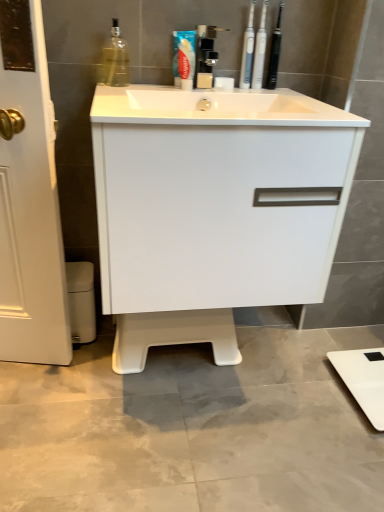
Question: Is white plastic toothbrushes at upper right, placed as the third toiletry when sorted from right to left, touching blue glossy toothpaste at upper center?

Choices:
 (A) no
 (B) yes

Answer: (A)

Question: Is white plastic toothbrushes at upper right, placed as the third toiletry when sorted from right to left, positioned behind blue glossy toothpaste at upper center?

Choices:
 (A) yes
 (B) no

Answer: (A)

Question: Is white plastic toothbrushes at upper right, which is the first toiletry from left to right, to the left of blue glossy toothpaste at upper center from the viewer's perspective?

Choices:
 (A) yes
 (B) no

Answer: (B)

Question: Considering the relative sizes of white plastic toothbrushes at upper right, placed as the third toiletry when sorted from right to left, and blue glossy toothpaste at upper center in the image provided, is white plastic toothbrushes at upper right, placed as the third toiletry when sorted from right to left, taller than blue glossy toothpaste at upper center?

Choices:
 (A) yes
 (B) no

Answer: (A)

Question: Considering the relative sizes of white plastic toothbrushes at upper right, which is the first toiletry from left to right, and blue glossy toothpaste at upper center in the image provided, is white plastic toothbrushes at upper right, which is the first toiletry from left to right, wider than blue glossy toothpaste at upper center?

Choices:
 (A) no
 (B) yes

Answer: (A)

Question: Does white plastic toothbrushes at upper right, placed as the third toiletry when sorted from right to left, have a larger size compared to blue glossy toothpaste at upper center?

Choices:
 (A) no
 (B) yes

Answer: (A)

Question: Is translucent glass bottle at upper left closer to the viewer compared to white plastic toothbrushes at upper center, the 2th toiletry in the right-to-left sequence?

Choices:
 (A) no
 (B) yes

Answer: (B)

Question: Is translucent glass bottle at upper left at the right side of white plastic toothbrushes at upper center, the 2th toiletry in the right-to-left sequence?

Choices:
 (A) no
 (B) yes

Answer: (A)

Question: Are translucent glass bottle at upper left and white plastic toothbrushes at upper center, the 2th toiletry in the right-to-left sequence, making contact?

Choices:
 (A) no
 (B) yes

Answer: (A)

Question: Is translucent glass bottle at upper left taller than white plastic toothbrushes at upper center, the 2th toiletry in the right-to-left sequence?

Choices:
 (A) no
 (B) yes

Answer: (A)

Question: From a real-world perspective, is translucent glass bottle at upper left beneath white plastic toothbrushes at upper center, the 2th toiletry in the right-to-left sequence?

Choices:
 (A) yes
 (B) no

Answer: (A)

Question: Is white plastic toothbrushes at upper center, the 2th toiletry in the right-to-left sequence, located within translucent glass bottle at upper left?

Choices:
 (A) no
 (B) yes

Answer: (A)

Question: Is black plastic toothbrushes at upper center, the first toiletry when ordered from right to left, behind white glossy cabinet at center?

Choices:
 (A) no
 (B) yes

Answer: (B)